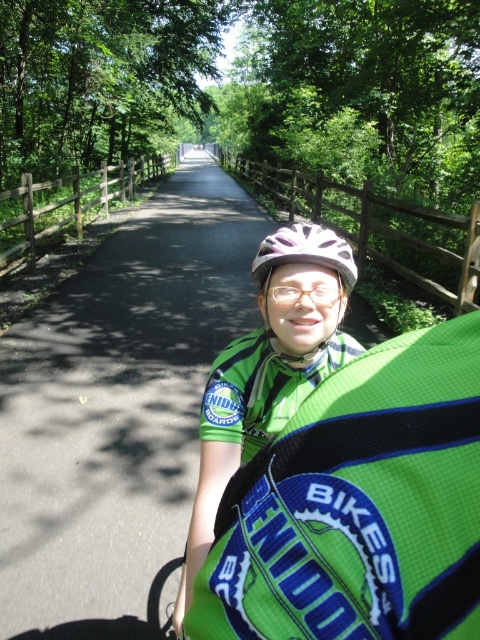
Can you confirm if white matte bicycle helmet at center is bigger than clear plastic goggles at center?

Indeed, white matte bicycle helmet at center has a larger size compared to clear plastic goggles at center.

Can you confirm if white matte bicycle helmet at center is positioned below clear plastic goggles at center?

Incorrect, white matte bicycle helmet at center is not positioned below clear plastic goggles at center.

Where is `white matte bicycle helmet at center`? The image size is (480, 640). white matte bicycle helmet at center is located at coordinates (304, 252).

Does black asphalt path at center have a greater width compared to clear plastic goggles at center?

Yes, black asphalt path at center is wider than clear plastic goggles at center.

Who is lower down, black asphalt path at center or clear plastic goggles at center?

clear plastic goggles at center is lower down.

Which is behind, point (146, 356) or point (288, 294)?

Positioned behind is point (146, 356).

You are a GUI agent. You are given a task and a screenshot of the screen. Output one action in this format:
    pyautogui.click(x=<x>, y=<y>)
    Task: Click on the black asphalt path at center
    
    Given the screenshot: What is the action you would take?
    pyautogui.click(x=119, y=412)

Which is below, black asphalt path at center or green mesh vest at center?

green mesh vest at center

Does black asphalt path at center lie in front of green mesh vest at center?

That is False.

Does point (112, 371) lie behind point (269, 308)?

Yes, point (112, 371) is farther from viewer.

Find the location of `black asphalt path at center`. black asphalt path at center is located at coordinates (119, 412).